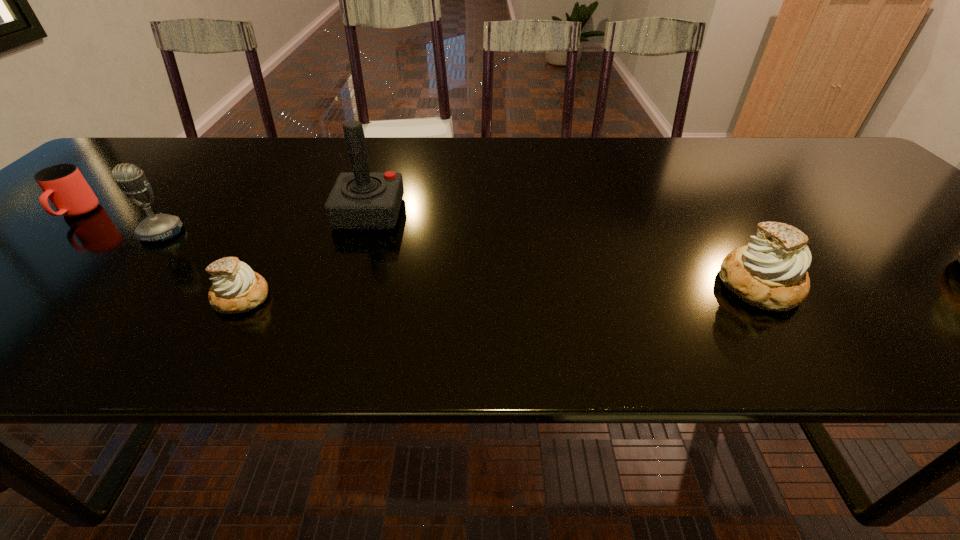
Where is `blank space located 0.220m on the back of the rightmost object`? blank space located 0.220m on the back of the rightmost object is located at coordinates (702, 202).

Locate an element on the screen. free space located on the handle side of the leftmost object is located at coordinates (18, 262).

Find the location of a particular element. Image resolution: width=960 pixels, height=540 pixels. vacant space located 0.070m on the front-facing side of the second object from left to right is located at coordinates (132, 267).

I want to click on free space located on the base of the joystick, so point(556,213).

Where is `object situated at the left edge`? object situated at the left edge is located at coordinates (63, 184).

Locate an element on the screen. This screenshot has height=540, width=960. blank area at the far edge is located at coordinates (420, 170).

At what (x,y) coordinates should I click in order to perform the action: click on free space at the near edge of the desktop. Please return your answer as a coordinate pair (x, y). The height and width of the screenshot is (540, 960). Looking at the image, I should click on (50, 296).

Identify the location of vacant space at the right edge of the desktop. Image resolution: width=960 pixels, height=540 pixels. (894, 208).

In the image, there is a desktop. Find the location of `vacant space at the far left corner`. vacant space at the far left corner is located at coordinates (112, 169).

Find the location of `empty location between the fourth object from left to right and the leftmost object`. empty location between the fourth object from left to right and the leftmost object is located at coordinates (223, 213).